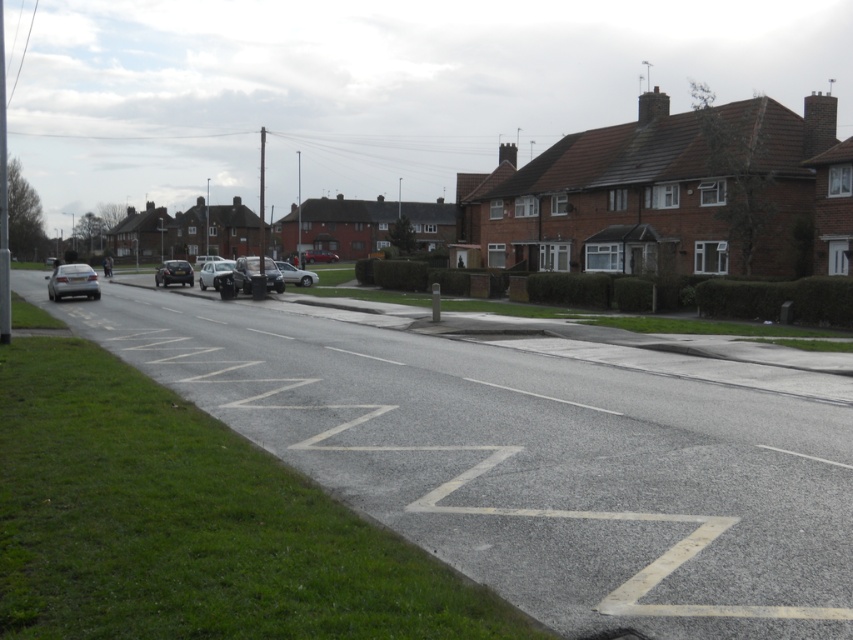
Is white asphalt road at center in front of silver metallic car at center?

Yes, white asphalt road at center is in front of silver metallic car at center.

Can you confirm if white asphalt road at center is smaller than silver metallic car at center?

Actually, white asphalt road at center might be larger than silver metallic car at center.

Locate an element on the screen. white asphalt road at center is located at coordinates (534, 456).

You are a GUI agent. You are given a task and a screenshot of the screen. Output one action in this format:
    pyautogui.click(x=<x>, y=<y>)
    Task: Click on the white asphalt road at center
    
    Given the screenshot: What is the action you would take?
    pyautogui.click(x=534, y=456)

Which of these two, shiny silver sedan at left or silver metallic car at center, stands taller?

With more height is shiny silver sedan at left.

Is shiny silver sedan at left to the right of silver metallic car at center from the viewer's perspective?

Incorrect, shiny silver sedan at left is not on the right side of silver metallic car at center.

Where is `shiny silver sedan at left`? The width and height of the screenshot is (853, 640). shiny silver sedan at left is located at coordinates click(73, 282).

Who is more forward, (384, 384) or (305, 252)?

Point (384, 384) is more forward.

Does white asphalt road at center have a lesser height compared to matte silver car at center?

Indeed, white asphalt road at center has a lesser height compared to matte silver car at center.

Is point (187, 390) farther from camera compared to point (328, 253)?

That is False.

Image resolution: width=853 pixels, height=640 pixels. I want to click on white asphalt road at center, so click(534, 456).